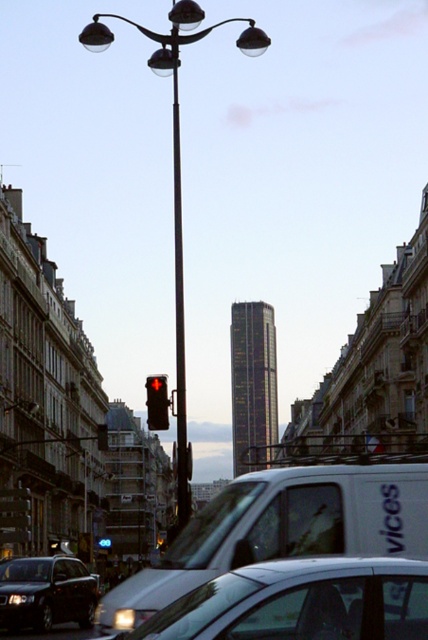
Is white matte van at center positioned in front of black plastic license plate at center?

That is True.

Who is more forward, [345,484] or [17,602]?

Point [345,484] is in front.

You are a GUI agent. You are given a task and a screenshot of the screen. Output one action in this format:
    pyautogui.click(x=<x>, y=<y>)
    Task: Click on the white matte van at center
    
    Given the screenshot: What is the action you would take?
    pyautogui.click(x=281, y=529)

Is shiny black sedan at lower left above black plastic license plate at center?

Actually, shiny black sedan at lower left is below black plastic license plate at center.

Does shiny black sedan at lower left lie behind black plastic license plate at center?

No, shiny black sedan at lower left is in front of black plastic license plate at center.

Is point (79, 570) positioned behind point (23, 595)?

Yes, it is behind point (23, 595).

Locate an element on the screen. The width and height of the screenshot is (428, 640). shiny black sedan at lower left is located at coordinates (47, 593).

Who is taller, white matte van at center or metallic streetlight at center?

metallic streetlight at center is taller.

Based on the photo, can you confirm if white matte van at center is bigger than metallic streetlight at center?

Actually, white matte van at center might be smaller than metallic streetlight at center.

Is point (249, 561) positioned in front of point (184, 19)?

Yes, it is in front of point (184, 19).

Locate an element on the screen. white matte van at center is located at coordinates (281, 529).